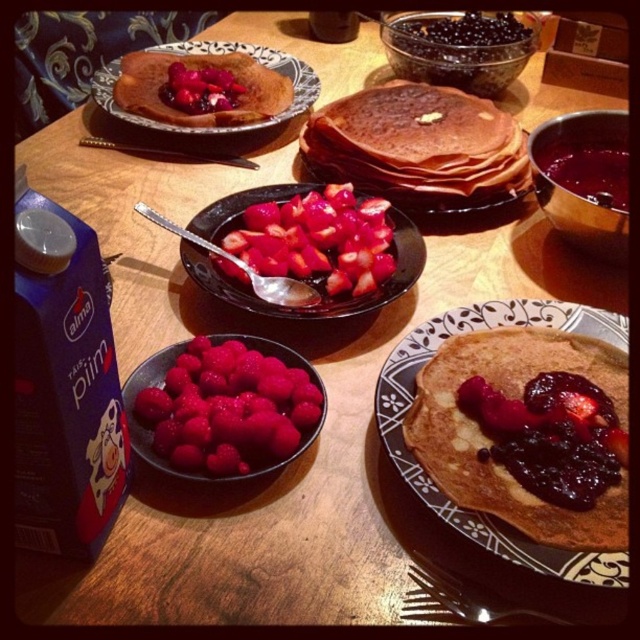
Question: Which of the following is the farthest from the observer?

Choices:
 (A) matte brown pancake stack at lower right
 (B) matte brown crepe at upper left

Answer: (B)

Question: Which of the following is the farthest from the observer?

Choices:
 (A) brown matte pancake at center
 (B) matte brown crepe at upper left

Answer: (B)

Question: Is matte brown pancake stack at lower right closer to camera compared to sliced red strawberries at center?

Choices:
 (A) yes
 (B) no

Answer: (A)

Question: Does bright red berries at center appear on the left side of brown matte pancake at center?

Choices:
 (A) no
 (B) yes

Answer: (B)

Question: Which of the following is the closest to the observer?

Choices:
 (A) bright red berries at center
 (B) matte brown crepe at upper left
 (C) shiny dark red jam at right
 (D) matte brown pancake stack at lower right

Answer: (D)

Question: Is matte brown pancake stack at lower right below matte brown crepe at upper left?

Choices:
 (A) no
 (B) yes

Answer: (B)